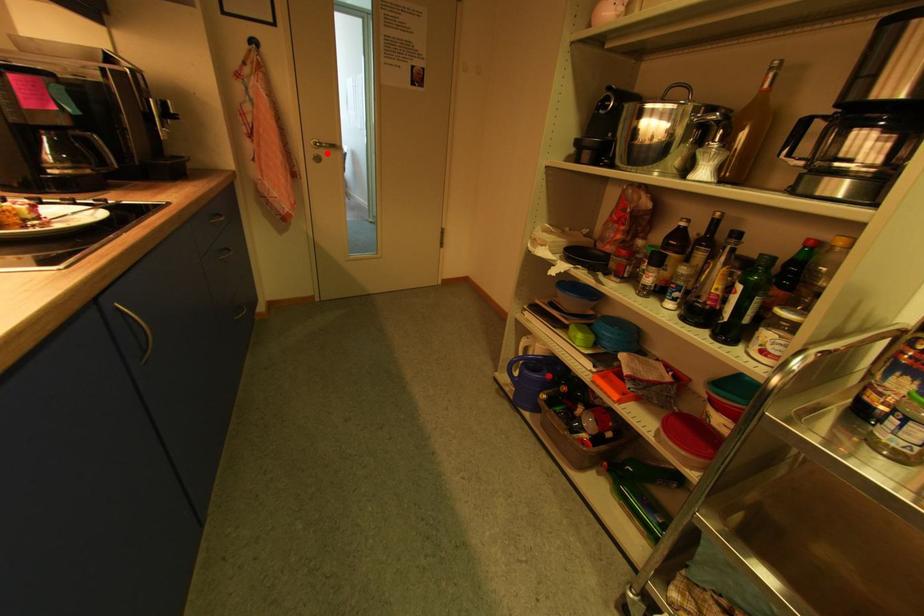
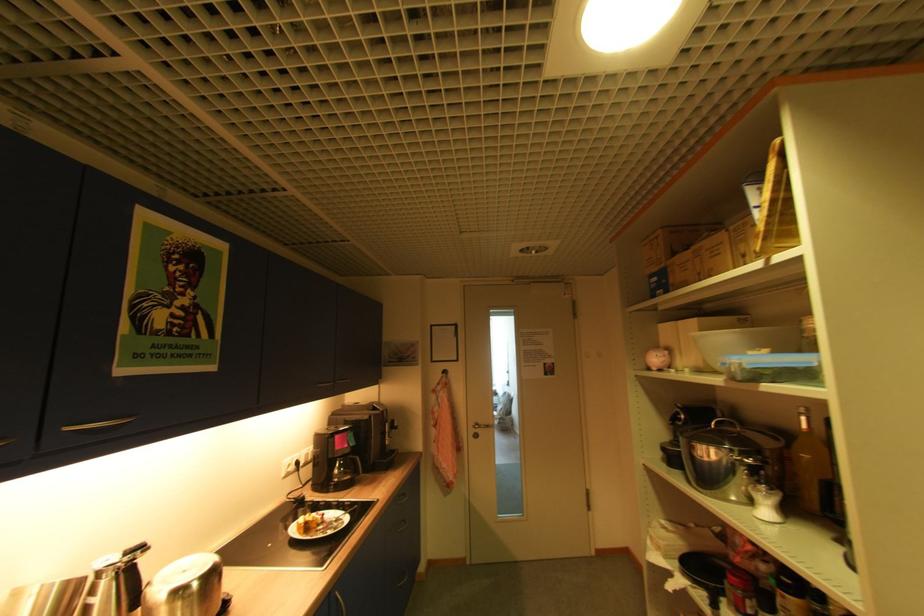
Question: I am providing you with two images of the same scene from different viewpoints. A red point is shown in image1. For the corresponding object point in image2, is it positioned nearer or farther from the camera?

Choices:
 (A) Nearer
 (B) Farther

Answer: (B)